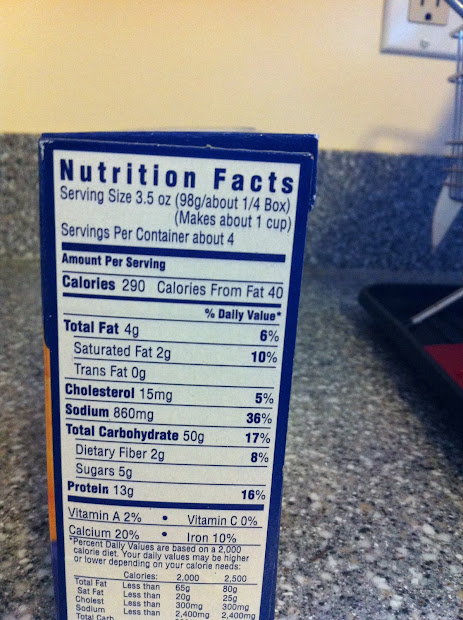
Identify the location of under plug plate. Image resolution: width=463 pixels, height=620 pixels. (422, 64).